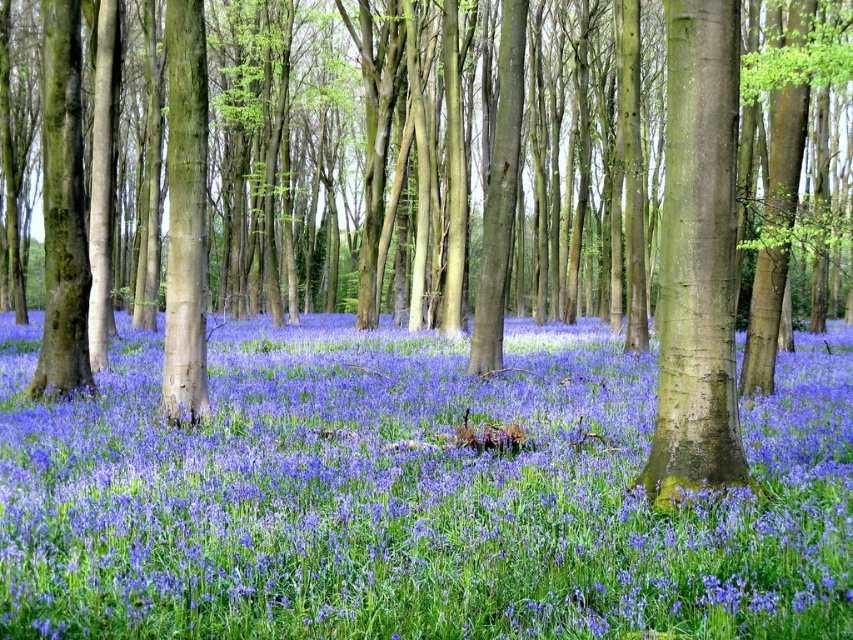
In the scene shown: Can you confirm if purple matte flower at center is taller than smooth brown tree trunk at center?

No, purple matte flower at center is not taller than smooth brown tree trunk at center.

Image resolution: width=853 pixels, height=640 pixels. I want to click on purple matte flower at center, so click(x=413, y=496).

Locate an element on the screen. purple matte flower at center is located at coordinates (413, 496).